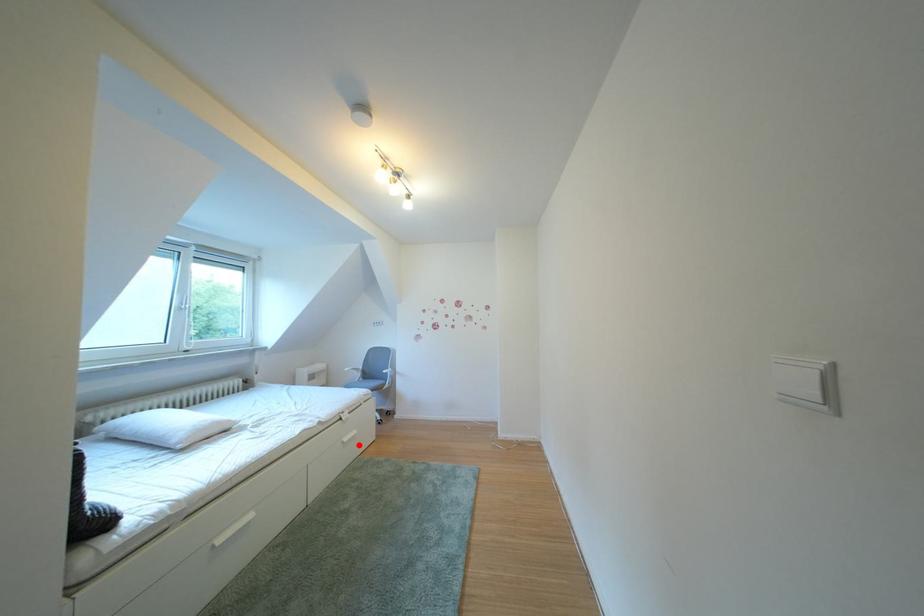
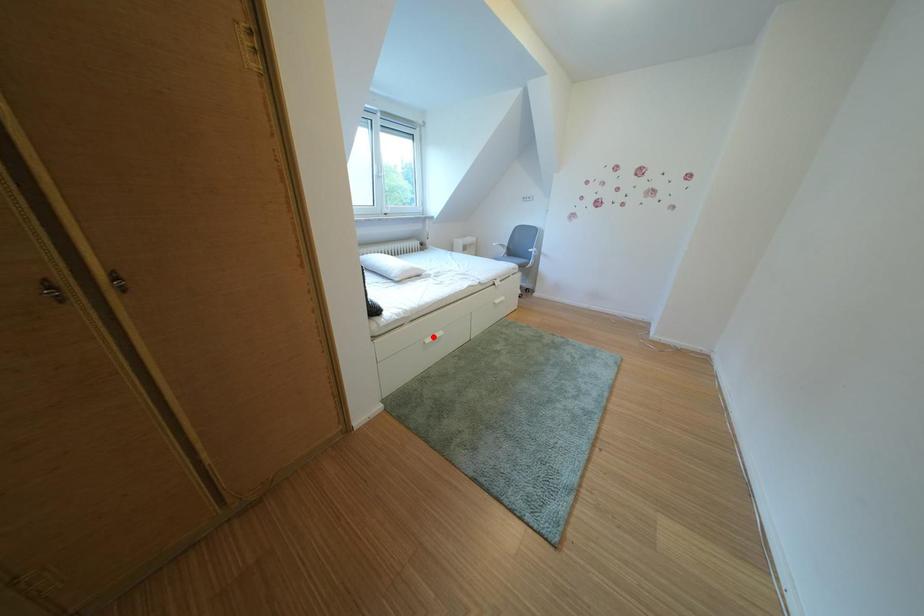
I am providing you with two images of the same scene from different viewpoints. A red point is marked on the first image and another point is marked on the second image. Are the points marked in image1 and image2 representing the same 3D position?

No